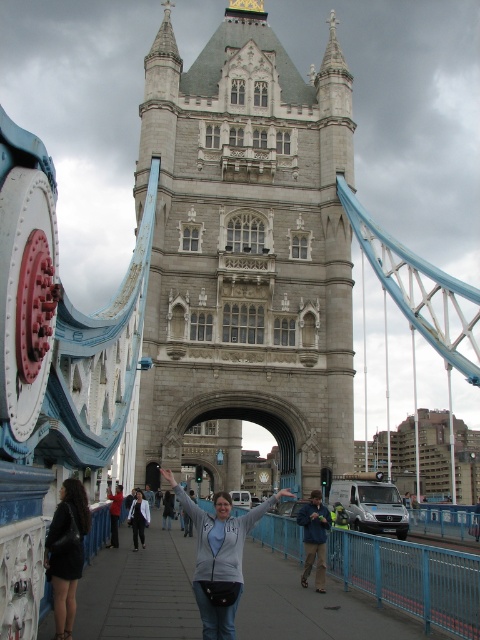
Who is more distant from viewer, (288, 152) or (249, 524)?

The point (288, 152) is more distant.

Who is positioned more to the right, gray stone tower at center or gray fleece jacket at center?

gray stone tower at center

At what (x,y) coordinates should I click in order to perform the action: click on gray stone tower at center. Please return your answer as a coordinate pair (x, y). This screenshot has width=480, height=640. Looking at the image, I should click on (247, 252).

The image size is (480, 640). In order to click on gray stone tower at center in this screenshot , I will do `click(247, 252)`.

Which is behind, point (66, 502) or point (136, 508)?

Point (136, 508)

Is black leather jacket at lower left wider than light gray sweater at center?

Yes.

What do you see at coordinates (67, 554) in the screenshot? I see `black leather jacket at lower left` at bounding box center [67, 554].

The image size is (480, 640). In order to click on black leather jacket at lower left in this screenshot , I will do `click(67, 554)`.

Which is behind, point (167, 128) or point (70, 499)?

Positioned behind is point (167, 128).

Is gray stone tower at center thinner than black leather jacket at lower left?

No.

Which is in front, point (266, 156) or point (66, 605)?

Positioned in front is point (66, 605).

Where is `gray stone tower at center`? The height and width of the screenshot is (640, 480). gray stone tower at center is located at coordinates (247, 252).